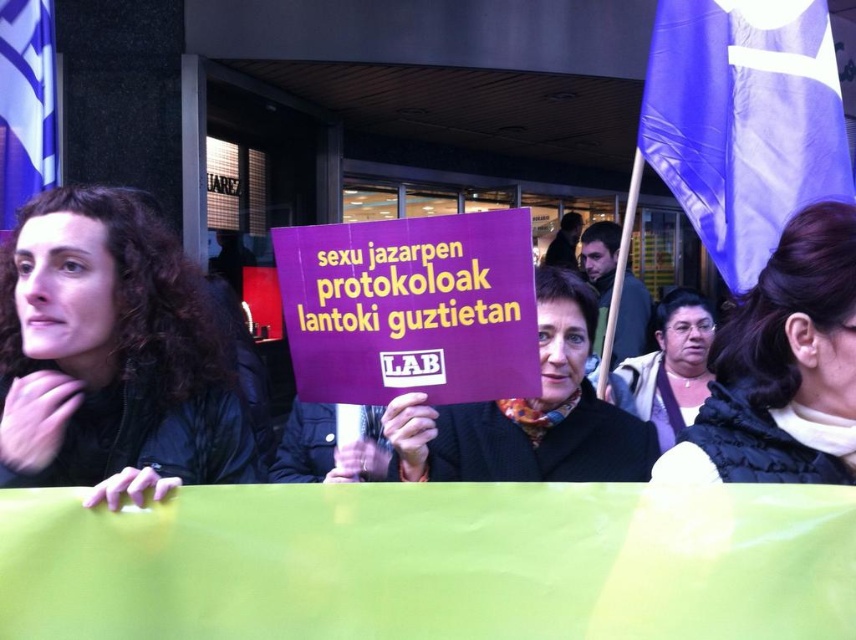
Does dark curly hair at left appear on the left side of matte black scarf at center?

Yes, dark curly hair at left is to the left of matte black scarf at center.

Between point (6, 452) and point (679, 428), which one is positioned behind?

The point (679, 428) is more distant.

Identify the location of dark curly hair at left. (111, 355).

Measure the distance from dark curly hair at left to purple fabric flag at upper right.

1.28 meters

Which is more to the right, dark curly hair at left or purple fabric flag at upper right?

Positioned to the right is purple fabric flag at upper right.

Locate an element on the screen. dark curly hair at left is located at coordinates (111, 355).

Is blue fabric flag at upper left in front of matte black scarf at center?

No, it is behind matte black scarf at center.

Consider the image. Is blue fabric flag at upper left taller than matte black scarf at center?

Yes.

I want to click on blue fabric flag at upper left, so click(25, 104).